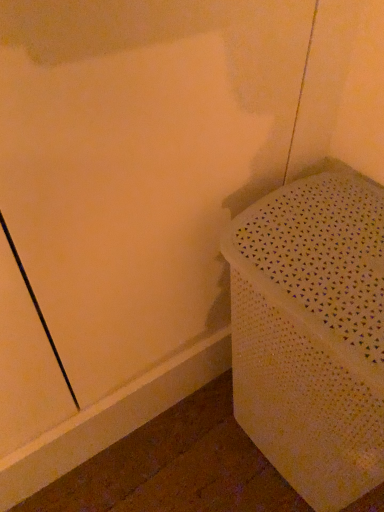
Describe the element at coordinates (312, 334) in the screenshot. I see `white plastic basket at lower right` at that location.

Where is `white plastic basket at lower right`? white plastic basket at lower right is located at coordinates (312, 334).

Identify the location of white plastic basket at lower right. The image size is (384, 512). (312, 334).